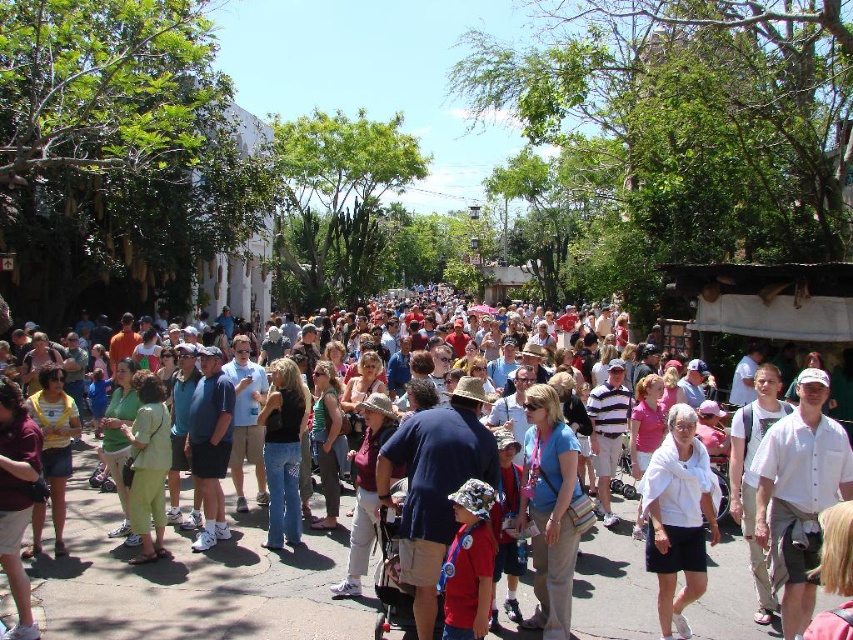
Is multicolored casual attire at center to the right of blue fabric shirt at center from the viewer's perspective?

In fact, multicolored casual attire at center is to the left of blue fabric shirt at center.

Is multicolored casual attire at center taller than blue fabric shirt at center?

Correct, multicolored casual attire at center is much taller as blue fabric shirt at center.

What do you see at coordinates (193, 586) in the screenshot?
I see `multicolored casual attire at center` at bounding box center [193, 586].

The image size is (853, 640). In order to click on multicolored casual attire at center in this screenshot , I will do `click(193, 586)`.

From the picture: Is black denim jeans at center bigger than green cotton shorts at center?

Yes, black denim jeans at center is bigger than green cotton shorts at center.

Is black denim jeans at center smaller than green cotton shorts at center?

Actually, black denim jeans at center might be larger than green cotton shorts at center.

Is point (270, 472) positioned before point (166, 406)?

Yes.

Identify the location of black denim jeans at center. (283, 451).

Is the position of denim shorts at lower left less distant than that of maroon fabric shirt at center?

Yes.

Measure the distance from denim shorts at lower left to maroon fabric shirt at center.

The distance of denim shorts at lower left from maroon fabric shirt at center is 12.26 meters.

Does point (9, 481) come farther from viewer compared to point (357, 406)?

No, (9, 481) is in front of (357, 406).

Find the location of a particular element. This screenshot has height=640, width=853. denim shorts at lower left is located at coordinates (16, 497).